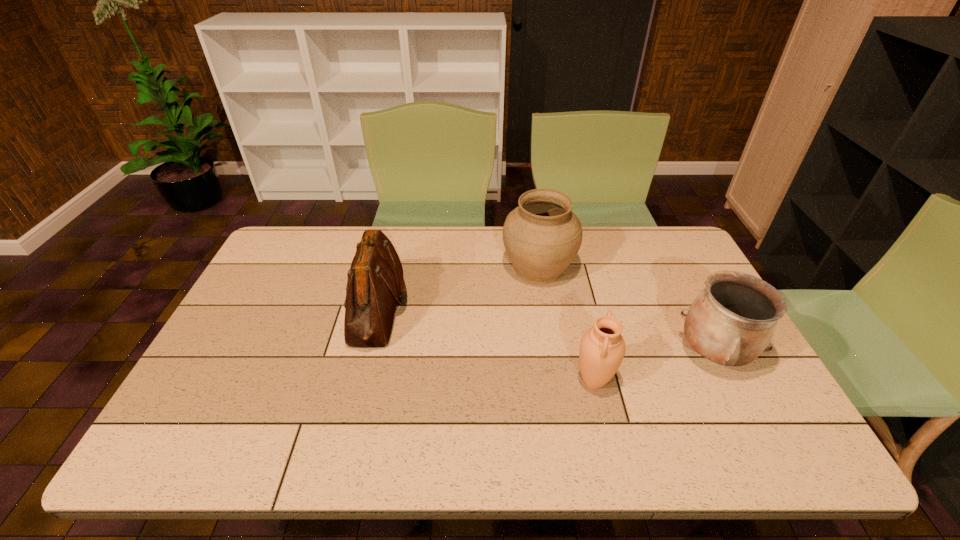
The width and height of the screenshot is (960, 540). I want to click on vacant space at the near edge of the desktop, so click(x=666, y=458).

This screenshot has height=540, width=960. In the image, there is a desktop. In order to click on vacant space at the left edge in this screenshot , I will do pyautogui.click(x=241, y=339).

The image size is (960, 540). I want to click on vacant area at the right edge of the desktop, so click(726, 366).

In order to click on free space at the far right corner of the desktop in this screenshot , I will do `click(673, 237)`.

Locate an element on the screen. The height and width of the screenshot is (540, 960). vacant space at the near right corner of the desktop is located at coordinates (762, 438).

You are a GUI agent. You are given a task and a screenshot of the screen. Output one action in this format:
    pyautogui.click(x=<x>, y=<y>)
    Task: Click on the unoccupied area between the shoulder bag and the rightmost object
    The height and width of the screenshot is (540, 960).
    Given the screenshot: What is the action you would take?
    pyautogui.click(x=545, y=330)

This screenshot has width=960, height=540. Find the location of `vacant space that is in between the farthest urn and the rightmost urn`. vacant space that is in between the farthest urn and the rightmost urn is located at coordinates (625, 311).

Identify the location of free spot between the farthest urn and the rightmost urn. (625, 311).

Where is `free spot between the shoulder bag and the rightmost object`? This screenshot has width=960, height=540. free spot between the shoulder bag and the rightmost object is located at coordinates (545, 330).

Locate an element on the screen. free space between the leftmost object and the rightmost urn is located at coordinates (545, 330).